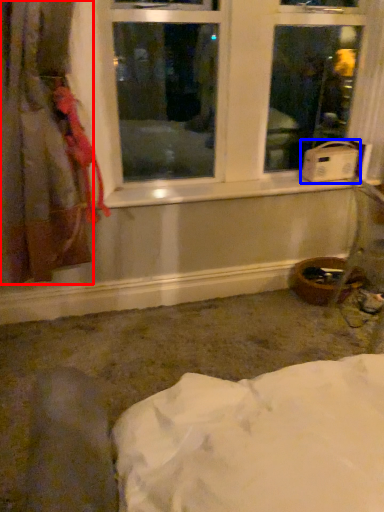
Question: Which object appears closest to the camera in this image, curtain (highlighted by a red box) or water heater (highlighted by a blue box)?

Choices:
 (A) curtain
 (B) water heater

Answer: (A)